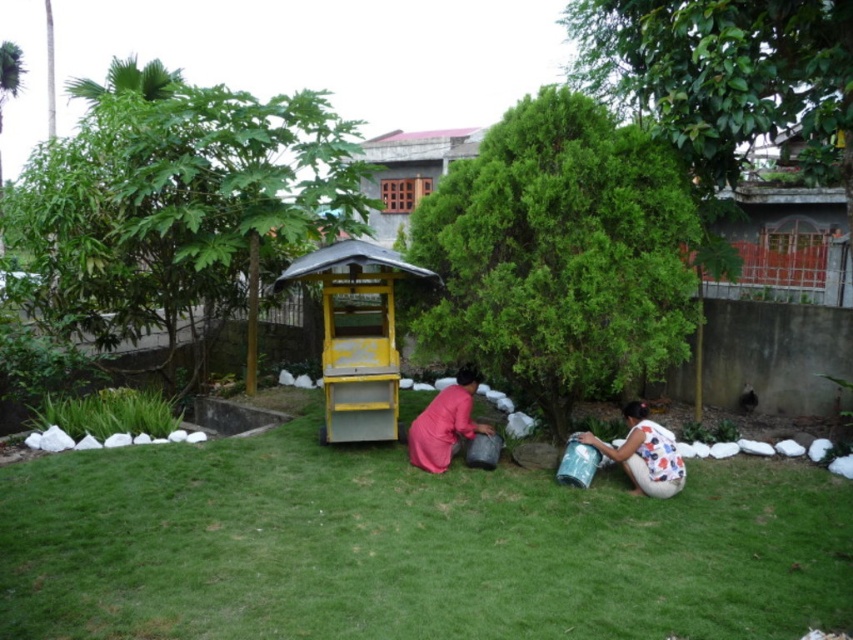
Consider the image. You are a gardener who needs to place a 1.5 meter long ladder between the green leafy tree at center and the pink matte fabric at center. Can the ladder fit between them without overlapping either object?

The distance between the green leafy tree at center and the pink matte fabric at center is 1.35 meters. Since the ladder is 1.5 meters long, it cannot fit between them without overlapping one or both objects.

You are standing at the center of the lawn in the backyard scene. If you look towards the green leafy tree at center, which direction should you face? Please answer with either north, south, east, or west.

The green leafy tree at center is located at coordinates approximately 0.398 on the x and 0.657 on the y. Since the center of the image is typically considered as the origin point, the tree is slightly to the left and above the center. However, without specific directional markers like a compass or landmarks indicating orientation, it is impossible to determine the exact cardinal direction. Therefore, the question cannot be accurately answered with the given information.

You are standing at the center of the lawn and see the two people with buckets. There is a point marked at coordinates (180, 198). What object is this point located on?

The point at (180, 198) is located on the green leafy tree at upper left.